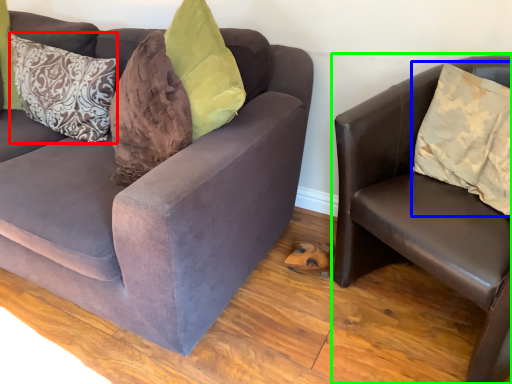
Question: Which is farther away from pillow (highlighted by a red box)? pillow (highlighted by a blue box) or studio couch (highlighted by a green box)?

Choices:
 (A) pillow
 (B) studio couch

Answer: (A)